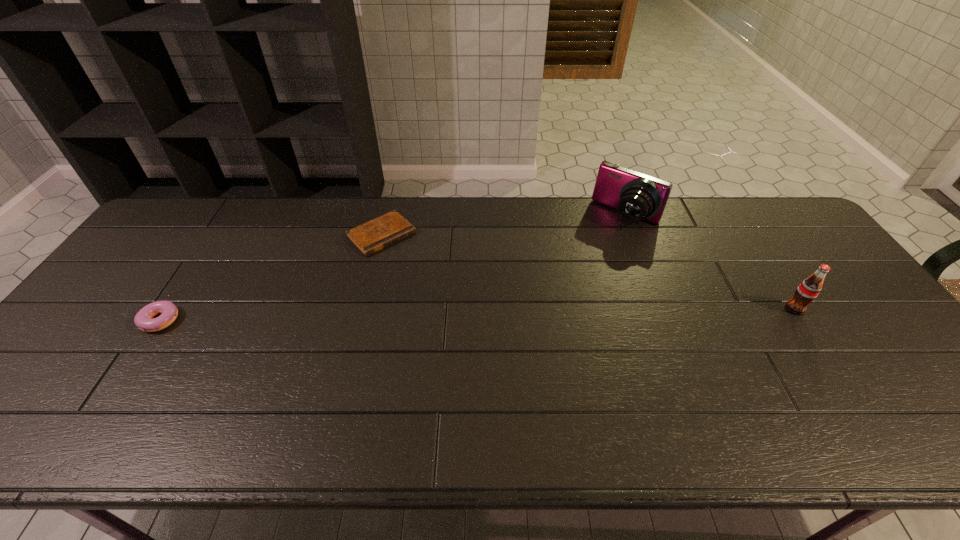
Where is `vacant space on the desktop that is between the leftmost object and the rightmost object and is positioned on the spine side of the diary`? The width and height of the screenshot is (960, 540). vacant space on the desktop that is between the leftmost object and the rightmost object and is positioned on the spine side of the diary is located at coordinates (464, 313).

The width and height of the screenshot is (960, 540). I want to click on free space on the desktop that is between the doughnut and the rightmost object and is positioned on the front-facing side of the third object from left to right, so click(x=548, y=312).